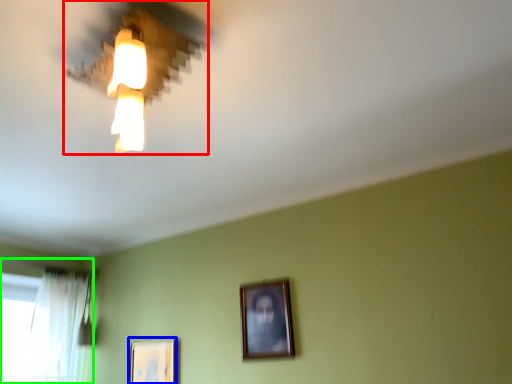
Question: Which object is positioned closest to lamp (highlighted by a red box)? Select from picture frame (highlighted by a blue box) and window (highlighted by a green box).

Choices:
 (A) picture frame
 (B) window

Answer: (A)